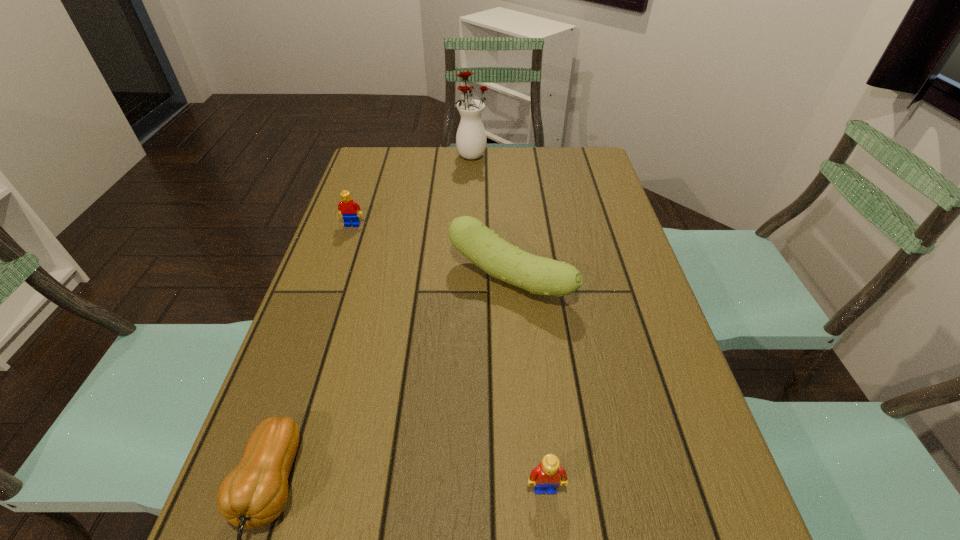
At what (x,y) coordinates should I click in order to perform the action: click on vacant point located between the fourth nearest object and the farthest object. Please return your answer as a coordinate pair (x, y). Looking at the image, I should click on (413, 190).

Locate an element on the screen. The image size is (960, 540). free space between the vase and the left Lego is located at coordinates (413, 190).

Identify the location of free area in between the right Lego and the farther Lego. Image resolution: width=960 pixels, height=540 pixels. (449, 356).

At what (x,y) coordinates should I click in order to perform the action: click on the fourth closest object relative to the third nearest object. Please return your answer as a coordinate pair (x, y). This screenshot has height=540, width=960. Looking at the image, I should click on (471, 140).

You are a GUI agent. You are given a task and a screenshot of the screen. Output one action in this format:
    pyautogui.click(x=<x>, y=<y>)
    Task: Click on the object that can be found as the third closest to the farthest object
    This screenshot has height=540, width=960.
    Given the screenshot: What is the action you would take?
    pyautogui.click(x=254, y=494)

The width and height of the screenshot is (960, 540). What are the coordinates of `blank space that satisfies the following two spatial constraints: 1. on the front-facing side of the second farthest object; 2. on the left side of the third nearest object` in the screenshot? It's located at (334, 278).